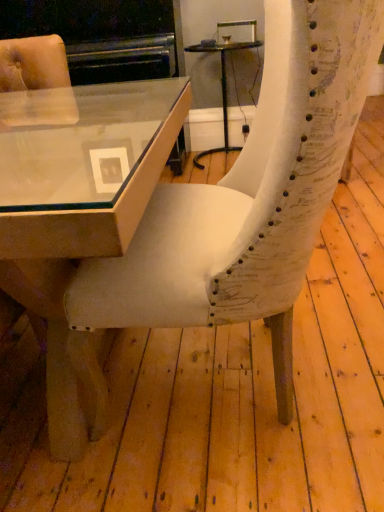
The width and height of the screenshot is (384, 512). Find the location of `matte glass table at center, placed as the second table when sorted from right to left`. matte glass table at center, placed as the second table when sorted from right to left is located at coordinates (77, 216).

Locate an element on the screen. The width and height of the screenshot is (384, 512). matte glass table at center, placed as the second table when sorted from right to left is located at coordinates (77, 216).

Would you say white textured chair at center is inside or outside matte glass table at center, placed as the second table when sorted from right to left?

white textured chair at center lies within the bounds of matte glass table at center, placed as the second table when sorted from right to left.

In the image, is white textured chair at center positioned in front of or behind matte glass table at center, which is counted as the second table, starting from the back?

Clearly, white textured chair at center is behind matte glass table at center, which is counted as the second table, starting from the back.

In the image, is white textured chair at center on the left side or the right side of matte glass table at center, which appears as the second table when viewed from the top?

Based on their positions, white textured chair at center is located to the right of matte glass table at center, which appears as the second table when viewed from the top.

Which point is more distant from viewer, (316, 18) or (161, 123)?

The point (161, 123) is behind.

Is point (141, 126) closer to camera compared to point (298, 108)?

No.

Can you confirm if matte glass table at center, which is the first table in front-to-back order, is positioned to the left of white textured chair at center?

Indeed, matte glass table at center, which is the first table in front-to-back order, is positioned on the left side of white textured chair at center.

From a real-world perspective, is matte glass table at center, which is the first table in front-to-back order, located higher than white textured chair at center?

No, from a real-world perspective, matte glass table at center, which is the first table in front-to-back order, is not above white textured chair at center.

Is the depth of matte glass table at center, the 1th table ordered from the bottom, greater than that of white textured chair at center?

No, the depth of matte glass table at center, the 1th table ordered from the bottom, is less than that of white textured chair at center.

From a real-world perspective, which object rests below the other?

matte glass table at center, the second table in the front-to-back sequence, is physically lower.

Considering the relative sizes of matte glass table at center, the 2th table in the bottom-to-top sequence, and matte glass table at center, the 1th table ordered from the bottom, in the image provided, is matte glass table at center, the 2th table in the bottom-to-top sequence, smaller than matte glass table at center, the 1th table ordered from the bottom,?

Correct, matte glass table at center, the 2th table in the bottom-to-top sequence, occupies less space than matte glass table at center, the 1th table ordered from the bottom.

Is matte glass table at center, positioned as the first table in top-to-bottom order, directly adjacent to matte glass table at center, which appears as the second table when viewed from the top?

No, matte glass table at center, positioned as the first table in top-to-bottom order, is not in contact with matte glass table at center, which appears as the second table when viewed from the top.

Is matte glass table at center, the second table in the front-to-back sequence, turned away from matte glass table at center, which is the first table in front-to-back order?

matte glass table at center, the second table in the front-to-back sequence, does not have its back to matte glass table at center, which is the first table in front-to-back order.

Considering the positions of point (171, 144) and point (211, 40), is point (171, 144) closer or farther from the camera than point (211, 40)?

Point (171, 144) is closer to the camera than point (211, 40).

Is matte glass table at center, which is the first table in front-to-back order, aimed at matte glass table at center, the 2th table in the bottom-to-top sequence?

No, matte glass table at center, which is the first table in front-to-back order, is not turned towards matte glass table at center, the 2th table in the bottom-to-top sequence.

Is there a large distance between matte glass table at center, which is counted as the second table, starting from the back, and matte glass table at center, the 2th table in the bottom-to-top sequence?

matte glass table at center, which is counted as the second table, starting from the back, is far away from matte glass table at center, the 2th table in the bottom-to-top sequence.

The width and height of the screenshot is (384, 512). Find the location of `table on the right of matte glass table at center, acting as the first table starting from the left`. table on the right of matte glass table at center, acting as the first table starting from the left is located at coordinates (221, 85).

From a real-world perspective, which object rests below the other?

matte glass table at center, positioned as the first table in top-to-bottom order, from a real-world perspective.

Is white textured chair at center positioned far away from matte glass table at center, the 2th table in the bottom-to-top sequence?

That's right, there is a large distance between white textured chair at center and matte glass table at center, the 2th table in the bottom-to-top sequence.

Can you confirm if white textured chair at center is bigger than matte glass table at center, the first table when ordered from right to left?

Indeed, white textured chair at center has a larger size compared to matte glass table at center, the first table when ordered from right to left.

Is white textured chair at center taller or shorter than matte glass table at center, the first table when ordered from right to left?

white textured chair at center is taller than matte glass table at center, the first table when ordered from right to left.

Are matte glass table at center, positioned as the first table in top-to-bottom order, and white textured chair at center far apart?

Absolutely, matte glass table at center, positioned as the first table in top-to-bottom order, is distant from white textured chair at center.

Is matte glass table at center, the first table when ordered from right to left, to the left or to the right of white textured chair at center in the image?

From the image, it's evident that matte glass table at center, the first table when ordered from right to left, is to the right of white textured chair at center.

From a real-world perspective, who is located higher, matte glass table at center, which is the 2th table in left-to-right order, or white textured chair at center?

From a 3D spatial view, white textured chair at center is above.

Does matte glass table at center, positioned as the first table in top-to-bottom order, have a smaller size compared to white textured chair at center?

Yes, matte glass table at center, positioned as the first table in top-to-bottom order, is smaller than white textured chair at center.

Find the location of a particular element. table on the left of white textured chair at center is located at coordinates (77, 216).

I want to click on chair above the matte glass table at center, which is the first table in front-to-back order (from a real-world perspective), so click(x=249, y=195).

From the image, which object appears to be farther from matte glass table at center, positioned as the first table in top-to-bottom order, white textured chair at center or matte glass table at center, which is counted as the second table, starting from the back?

white textured chair at center is positioned further to the anchor matte glass table at center, positioned as the first table in top-to-bottom order.

From the image, which object appears to be nearer to matte glass table at center, acting as the first table starting from the left, matte glass table at center, the second table in the front-to-back sequence, or white textured chair at center?

Based on the image, white textured chair at center appears to be nearer to matte glass table at center, acting as the first table starting from the left.

When comparing their distances from white textured chair at center, does matte glass table at center, the 2th table in the bottom-to-top sequence, or matte glass table at center, the 1th table ordered from the bottom, seem closer?

matte glass table at center, the 1th table ordered from the bottom, is closer to white textured chair at center.

Which object lies further to the anchor point matte glass table at center, the first table when ordered from right to left, matte glass table at center, which is the first table in front-to-back order, or white textured chair at center?

The object further to matte glass table at center, the first table when ordered from right to left, is white textured chair at center.

When comparing their distances from matte glass table at center, which appears as the second table when viewed from the top, does white textured chair at center or matte glass table at center, the 2th table in the bottom-to-top sequence, seem further?

The object further to matte glass table at center, which appears as the second table when viewed from the top, is matte glass table at center, the 2th table in the bottom-to-top sequence.

Estimate the real-world distances between objects in this image. Which object is closer to white textured chair at center, matte glass table at center, placed as the second table when sorted from right to left, or matte glass table at center, positioned as the first table in top-to-bottom order?

matte glass table at center, placed as the second table when sorted from right to left, lies closer to white textured chair at center than the other object.

Locate an element on the screen. The height and width of the screenshot is (512, 384). chair located between matte glass table at center, which is the first table in front-to-back order, and matte glass table at center, the second table in the front-to-back sequence, in the depth direction is located at coordinates (249, 195).